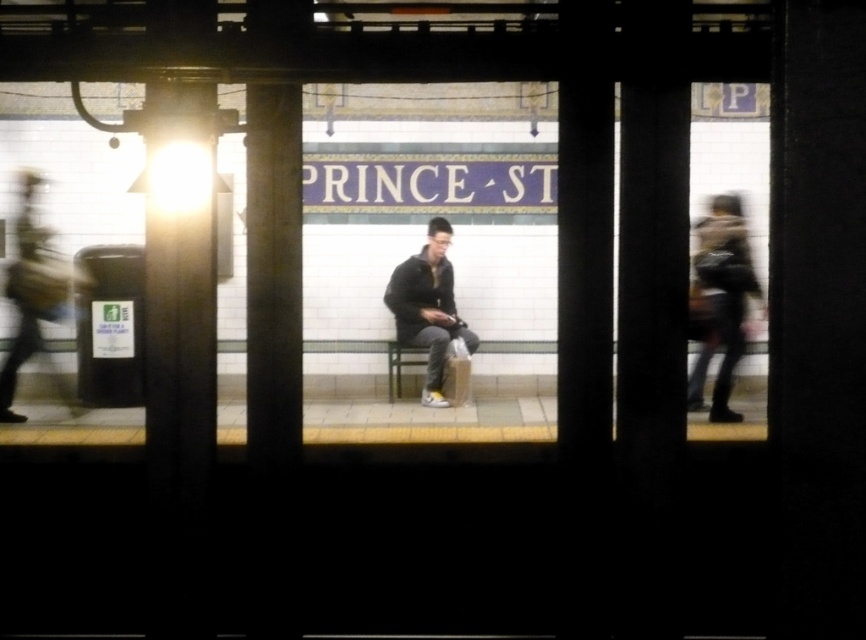
You are a delivery robot with a width of 12 inches. You need to navigate between the metallic column at left and the smooth concrete pillar at center. Can you fit through the space between them?

The metallic column at left and smooth concrete pillar at center are 11.88 inches apart from each other. Since the robot is 12 inches wide, it cannot fit through the space between them as the gap is narrower than the robot.